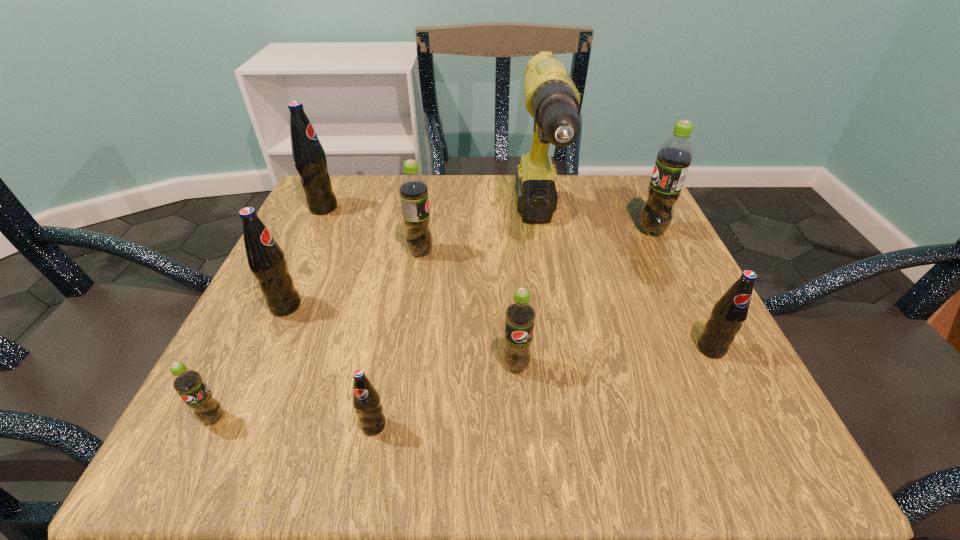
Identify the location of free space between the second black pop from right to left and the third soda from right to left. (444, 395).

This screenshot has height=540, width=960. What are the coordinates of `vacant region between the fifth nearest soda and the smallest green soda` in the screenshot? It's located at (250, 362).

Image resolution: width=960 pixels, height=540 pixels. What are the coordinates of `object that ranks as the second closest to the farthest black pop` in the screenshot? It's located at point(266,260).

Identify the location of the closest object to the nearest green soda. (266, 260).

Identify the location of soda that can be found as the fourth closest to the sixth nearest soda. (366, 400).

The width and height of the screenshot is (960, 540). Identify the location of soda that stands as the sixth closest to the second black pop from right to left. (309, 158).

Select which black pop is the closest to the second smallest black pop. Please provide its 2D coordinates. Your answer should be formatted as a tuple, i.e. [(x, y)], where the tuple contains the x and y coordinates of a point satisfying the conditions above.

[(366, 400)]

Select which black pop appears as the closest to the fifth nearest object. Please provide its 2D coordinates. Your answer should be formatted as a tuple, i.e. [(x, y)], where the tuple contains the x and y coordinates of a point satisfying the conditions above.

[(366, 400)]

Select which green soda is the closest to the third nearest green soda. Please provide its 2D coordinates. Your answer should be formatted as a tuple, i.e. [(x, y)], where the tuple contains the x and y coordinates of a point satisfying the conditions above.

[(520, 315)]

Select which green soda appears as the third closest to the nearest green soda. Please provide its 2D coordinates. Your answer should be formatted as a tuple, i.e. [(x, y)], where the tuple contains the x and y coordinates of a point satisfying the conditions above.

[(674, 157)]